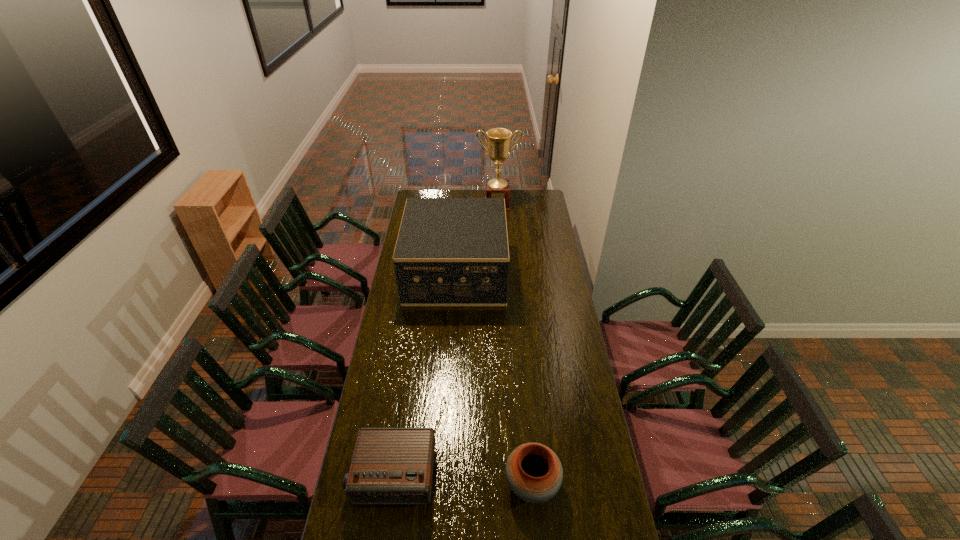
What are the coordinates of `free space between the pottery and the box` in the screenshot? It's located at (493, 378).

The width and height of the screenshot is (960, 540). Find the location of `free spot between the radio receiver and the farthest object`. free spot between the radio receiver and the farthest object is located at coordinates (445, 340).

This screenshot has height=540, width=960. In order to click on object that stands as the second closest to the pottery in this screenshot , I will do `click(450, 251)`.

You are a GUI agent. You are given a task and a screenshot of the screen. Output one action in this format:
    pyautogui.click(x=<x>, y=<y>)
    Task: Click on the object that is the third closest to the radio receiver
    
    Given the screenshot: What is the action you would take?
    coord(499,139)

Find the location of a particular element. The height and width of the screenshot is (540, 960). vacant area in the image that satisfies the following two spatial constraints: 1. on the plaque of the pottery; 2. on the left side of the farthest object is located at coordinates (513, 484).

This screenshot has width=960, height=540. I want to click on vacant region that satisfies the following two spatial constraints: 1. on the front-facing side of the box; 2. on the right side of the pottery, so click(x=443, y=484).

Find the location of a particular element. The height and width of the screenshot is (540, 960). free location that satisfies the following two spatial constraints: 1. on the front panel of the radio receiver; 2. on the left side of the pottery is located at coordinates (392, 484).

You are a GUI agent. You are given a task and a screenshot of the screen. Output one action in this format:
    pyautogui.click(x=<x>, y=<y>)
    Task: Click on the free space in the image that satisfies the following two spatial constraints: 1. on the front panel of the radio receiver; 2. on the left side of the pottery
    This screenshot has height=540, width=960.
    Given the screenshot: What is the action you would take?
    coord(392,484)

Where is `vacant region that satisfies the following two spatial constraints: 1. on the plaque of the trophy cup; 2. on the left side of the pottery`? This screenshot has width=960, height=540. vacant region that satisfies the following two spatial constraints: 1. on the plaque of the trophy cup; 2. on the left side of the pottery is located at coordinates (513, 484).